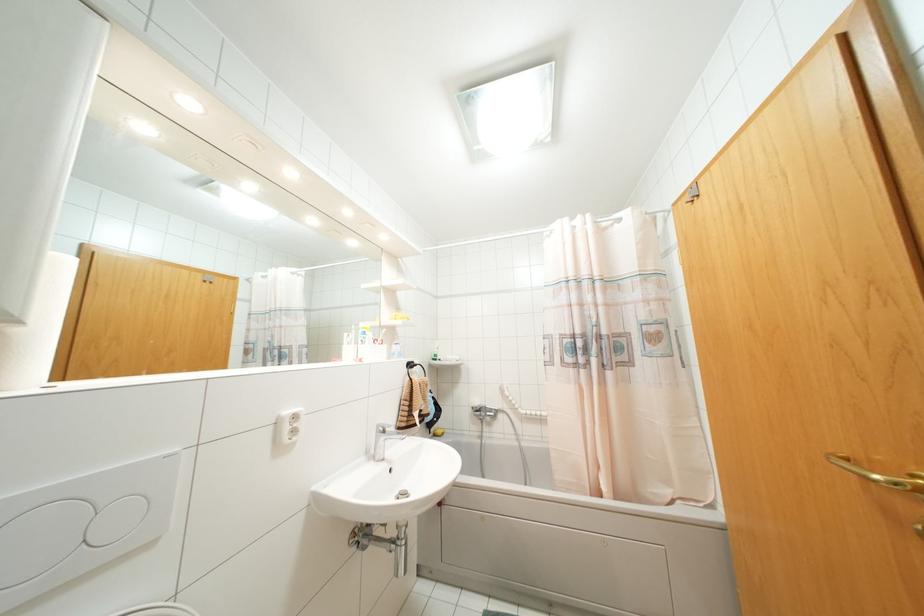
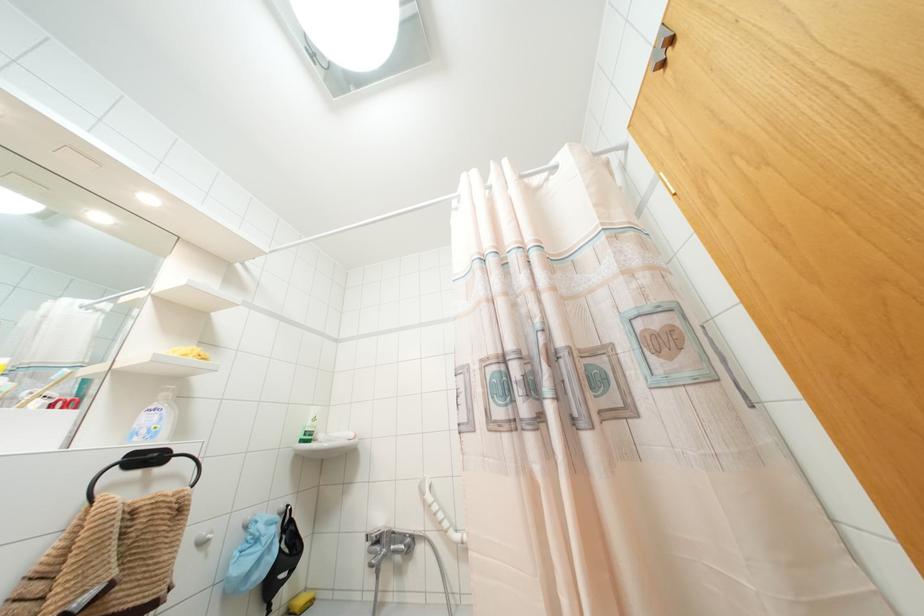
Where in the second image is the point corresponding to pixel 409 365 from the first image?

(147, 458)